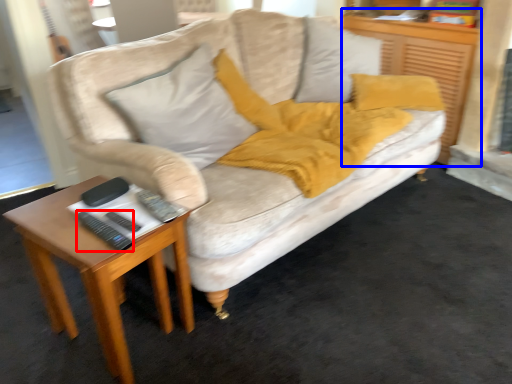
Question: Which of the following is the closest to the observer, remote (highlighted by a red box) or dresser (highlighted by a blue box)?

Choices:
 (A) remote
 (B) dresser

Answer: (A)